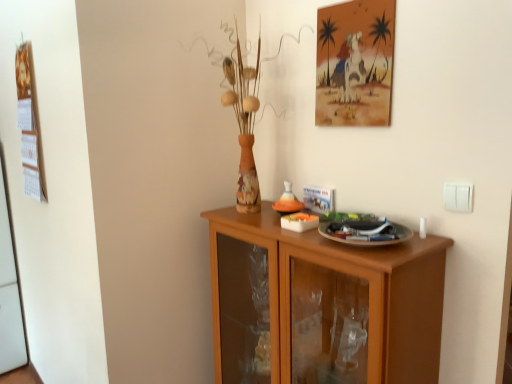
Measure the distance between point (22, 57) and camera.

The distance of point (22, 57) from camera is 1.86 meters.

You are a GUI agent. You are given a task and a screenshot of the screen. Output one action in this format:
    pyautogui.click(x=<x>, y=<y>)
    Task: Click on the watercolor paper painting at upper center, the 1th picture frame viewed from the right
    The width and height of the screenshot is (512, 384).
    Given the screenshot: What is the action you would take?
    pyautogui.click(x=355, y=63)

Locate an element on the screen. white plastic switch at upper right is located at coordinates (458, 197).

Which object is wider, white plastic switch at upper right or watercolor paper painting at upper center, the second picture frame when ordered from back to front?

Wider between the two is watercolor paper painting at upper center, the second picture frame when ordered from back to front.

Are white plastic switch at upper right and watercolor paper painting at upper center, which is the second picture frame in left-to-right order, making contact?

No.

Considering the sizes of white plastic switch at upper right and watercolor paper painting at upper center, the second picture frame when ordered from back to front, in the image, is white plastic switch at upper right bigger or smaller than watercolor paper painting at upper center, the second picture frame when ordered from back to front,?

Clearly, white plastic switch at upper right is smaller in size than watercolor paper painting at upper center, the second picture frame when ordered from back to front.

Would you say white plastic switch at upper right is part of wooden calendar at left, which is the 2th picture frame from right to left,'s contents?

No, white plastic switch at upper right is not inside wooden calendar at left, which is the 2th picture frame from right to left.

Looking at their sizes, would you say wooden calendar at left, which ranks as the 1th picture frame in back-to-front order, is wider or thinner than white plastic switch at upper right?

Clearly, wooden calendar at left, which ranks as the 1th picture frame in back-to-front order, has more width compared to white plastic switch at upper right.

From a real-world perspective, is wooden calendar at left, which is the 2th picture frame from right to left, positioned above or below white plastic switch at upper right?

wooden calendar at left, which is the 2th picture frame from right to left, is situated higher than white plastic switch at upper right in the real world.

From the image's perspective, who appears lower, wooden calendar at left, which ranks as the 1th picture frame in back-to-front order, or white plastic switch at upper right?

From the image's view, white plastic switch at upper right is below.

Which point is more forward, (463, 197) or (36, 164)?

The point (463, 197) is in front.

What's the angular difference between white plastic switch at upper right and wooden calendar at left, which is the 2th picture frame in front-to-back order,'s facing directions?

The facing directions of white plastic switch at upper right and wooden calendar at left, which is the 2th picture frame in front-to-back order, are 0.00124 degrees apart.

From a real-world perspective, between white plastic switch at upper right and wooden calendar at left, which is the 2th picture frame from right to left, who is vertically lower?

white plastic switch at upper right.

From the image's perspective, is white plastic switch at upper right above or below wooden calendar at left, which is counted as the 1th picture frame, starting from the left?

Based on their image positions, white plastic switch at upper right is located beneath wooden calendar at left, which is counted as the 1th picture frame, starting from the left.

Looking at this image, relative to watercolor paper painting at upper center, the 1th picture frame viewed from the right, is brown wooden cabinet at center in front or behind?

brown wooden cabinet at center is in front of watercolor paper painting at upper center, the 1th picture frame viewed from the right.

From the picture: Who is taller, brown wooden cabinet at center or watercolor paper painting at upper center, which is the 1th picture frame in front-to-back order?

brown wooden cabinet at center.

From the image's perspective, is brown wooden cabinet at center located above or below watercolor paper painting at upper center, which is the 1th picture frame in front-to-back order?

Based on their image positions, brown wooden cabinet at center is located beneath watercolor paper painting at upper center, which is the 1th picture frame in front-to-back order.

Is brown wooden cabinet at center wider than watercolor paper painting at upper center, the second picture frame when ordered from back to front?

Indeed, brown wooden cabinet at center has a greater width compared to watercolor paper painting at upper center, the second picture frame when ordered from back to front.

From a real-world perspective, is wooden calendar at left, which is the 2th picture frame in front-to-back order, positioned over brown wooden cabinet at center based on gravity?

Correct, in the physical world, wooden calendar at left, which is the 2th picture frame in front-to-back order, is higher than brown wooden cabinet at center.

How different are the orientations of wooden calendar at left, which is the 2th picture frame from right to left, and brown wooden cabinet at center in degrees?

There is a 0.00111-degree angle between the facing directions of wooden calendar at left, which is the 2th picture frame from right to left, and brown wooden cabinet at center.

Based on their sizes in the image, would you say wooden calendar at left, which ranks as the 1th picture frame in back-to-front order, is bigger or smaller than brown wooden cabinet at center?

Clearly, wooden calendar at left, which ranks as the 1th picture frame in back-to-front order, is smaller in size than brown wooden cabinet at center.

Is point (27, 179) closer or farther from the camera than point (325, 358)?

Point (27, 179) appears to be farther away from the viewer than point (325, 358).

Where is `cabinetry directly beneath the white plastic switch at upper right (from a real-world perspective)`? The height and width of the screenshot is (384, 512). cabinetry directly beneath the white plastic switch at upper right (from a real-world perspective) is located at coordinates (322, 305).

Which is correct: brown wooden cabinet at center is inside white plastic switch at upper right, or outside of it?

brown wooden cabinet at center is spatially situated outside white plastic switch at upper right.

Is brown wooden cabinet at center not close to white plastic switch at upper right?

They are positioned close to each other.

Based on the photo, from the image's perspective, does brown wooden cabinet at center appear lower than white plastic switch at upper right?

Yes, from the image's perspective, brown wooden cabinet at center is beneath white plastic switch at upper right.

Based on the photo, can you confirm if watercolor paper painting at upper center, which is the 1th picture frame in front-to-back order, is positioned to the left of brown wooden cabinet at center?

No, watercolor paper painting at upper center, which is the 1th picture frame in front-to-back order, is not to the left of brown wooden cabinet at center.

Does watercolor paper painting at upper center, the second picture frame when ordered from back to front, come behind brown wooden cabinet at center?

Yes, it is.

From the image's perspective, which object appears higher, watercolor paper painting at upper center, which is the second picture frame in left-to-right order, or brown wooden cabinet at center?

watercolor paper painting at upper center, which is the second picture frame in left-to-right order, is shown above in the image.

From a real-world perspective, is watercolor paper painting at upper center, the 1th picture frame viewed from the right, beneath brown wooden cabinet at center?

Actually, watercolor paper painting at upper center, the 1th picture frame viewed from the right, is physically above brown wooden cabinet at center in the real world.

The width and height of the screenshot is (512, 384). Identify the location of picture frame that is the 2nd object located above the white plastic switch at upper right (from the image's perspective). (355, 63).

The width and height of the screenshot is (512, 384). What are the coordinates of `picture frame that is the 1st object above the white plastic switch at upper right (from a real-world perspective)` in the screenshot? It's located at click(x=29, y=125).

Based on their spatial positions, is white plastic switch at upper right or brown wooden cabinet at center further from wooden calendar at left, which is the 2th picture frame in front-to-back order?

white plastic switch at upper right.

Considering their positions, is white plastic switch at upper right positioned further to wooden calendar at left, which is counted as the 1th picture frame, starting from the left, than watercolor paper painting at upper center, the 1th picture frame viewed from the right?

Based on the image, white plastic switch at upper right appears to be further to wooden calendar at left, which is counted as the 1th picture frame, starting from the left.

Which object lies nearer to the anchor point wooden calendar at left, which is the 2th picture frame from right to left, brown wooden cabinet at center or watercolor paper painting at upper center, the 1th picture frame viewed from the right?

Based on the image, brown wooden cabinet at center appears to be nearer to wooden calendar at left, which is the 2th picture frame from right to left.

From the image, which object appears to be nearer to watercolor paper painting at upper center, which is the second picture frame in left-to-right order, wooden calendar at left, which is the 2th picture frame in front-to-back order, or brown wooden cabinet at center?

brown wooden cabinet at center.

Estimate the real-world distances between objects in this image. Which object is further from white plastic switch at upper right, wooden calendar at left, which ranks as the 1th picture frame in back-to-front order, or watercolor paper painting at upper center, the 1th picture frame viewed from the right?

The object further to white plastic switch at upper right is wooden calendar at left, which ranks as the 1th picture frame in back-to-front order.

Estimate the real-world distances between objects in this image. Which object is closer to watercolor paper painting at upper center, the second picture frame when ordered from back to front, brown wooden cabinet at center or wooden calendar at left, which is counted as the 1th picture frame, starting from the left?

Among the two, brown wooden cabinet at center is located nearer to watercolor paper painting at upper center, the second picture frame when ordered from back to front.

Looking at the image, which one is located further to wooden calendar at left, which is the 2th picture frame from right to left, watercolor paper painting at upper center, the 1th picture frame viewed from the right, or brown wooden cabinet at center?

watercolor paper painting at upper center, the 1th picture frame viewed from the right.

From the image, which object appears to be farther from white plastic switch at upper right, watercolor paper painting at upper center, the second picture frame when ordered from back to front, or wooden calendar at left, which is the 2th picture frame from right to left?

wooden calendar at left, which is the 2th picture frame from right to left.

Identify the location of electric outlet between watercolor paper painting at upper center, the 1th picture frame viewed from the right, and brown wooden cabinet at center from top to bottom. The image size is (512, 384). (458, 197).

The image size is (512, 384). I want to click on cabinetry situated between wooden calendar at left, which ranks as the 1th picture frame in back-to-front order, and white plastic switch at upper right from left to right, so click(x=322, y=305).

Identify the location of picture frame situated between wooden calendar at left, which is counted as the 1th picture frame, starting from the left, and white plastic switch at upper right from left to right. This screenshot has width=512, height=384. (355, 63).

Find the location of a particular element. cabinetry between wooden calendar at left, which is counted as the 1th picture frame, starting from the left, and watercolor paper painting at upper center, which is the second picture frame in left-to-right order, in the horizontal direction is located at coordinates pos(322,305).